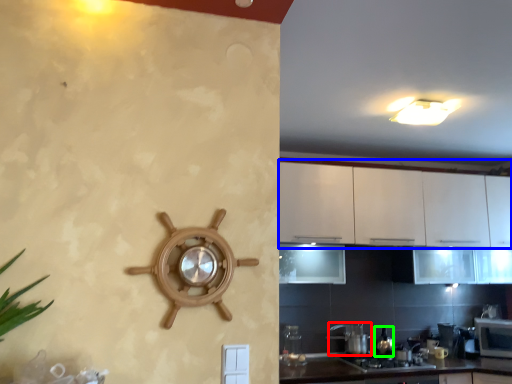
Question: Which object is the closest to the appliance (highlighted by a red box)? Choose among these: cabinetry (highlighted by a blue box) or appliance (highlighted by a green box).

Choices:
 (A) cabinetry
 (B) appliance

Answer: (B)